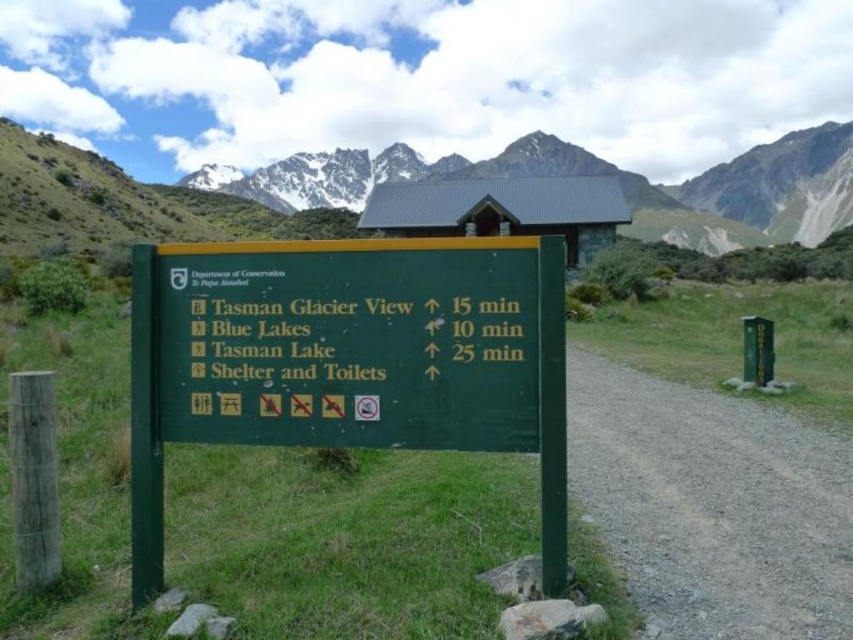
You are a hiker with a 50 meter long rope. You need to secure your gear between the green matte sign at center and the snowy granite mountain at upper center. Can your rope reach both objects without any extension?

The distance between the green matte sign at center and the snowy granite mountain at upper center is 56.93 meters. Since your rope is only 50 meters long, it is not long enough to span the distance between them without extension.